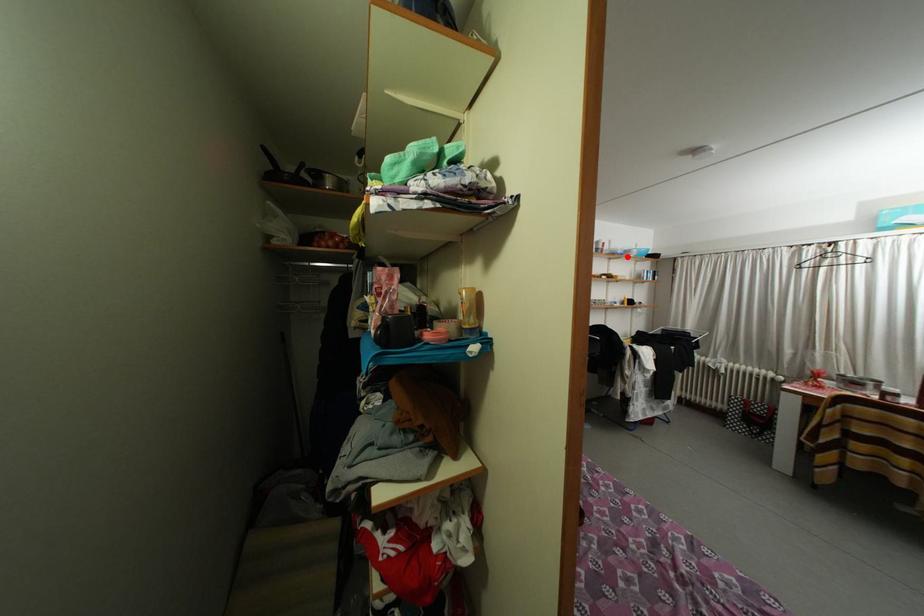
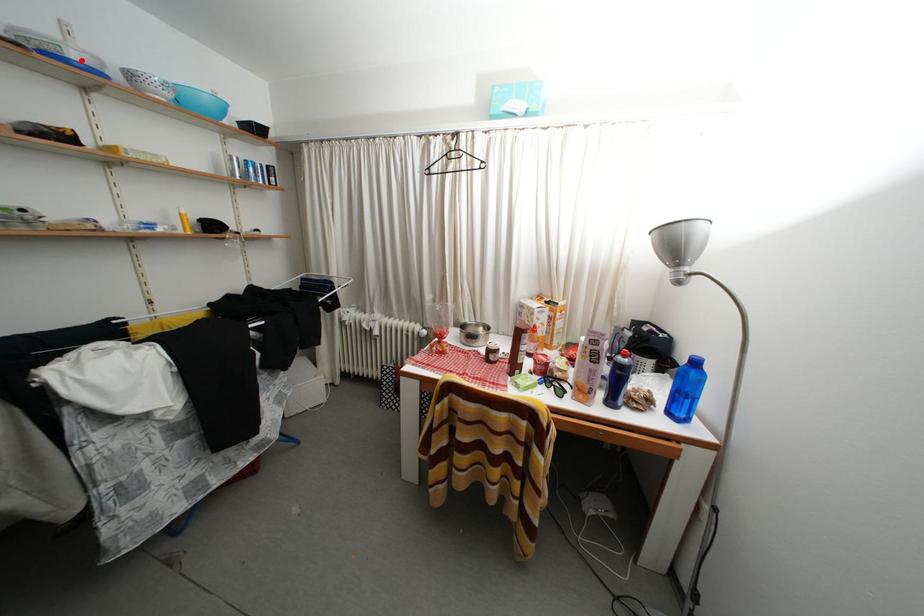
I am providing you with two images of the same scene from different viewpoints. A red point is marked on the first image and another point is marked on the second image. Is the red point in image1 aligned with the point shown in image2?

Yes